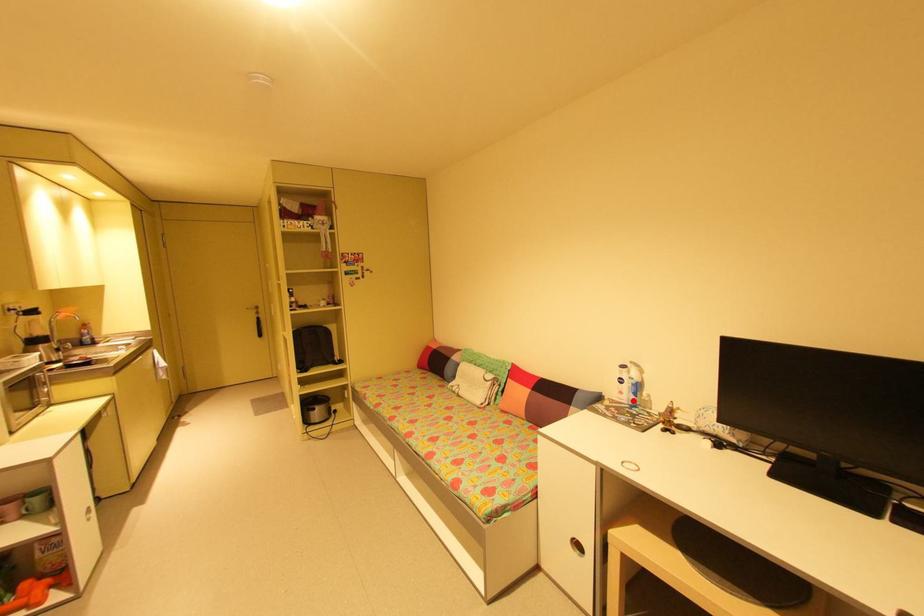
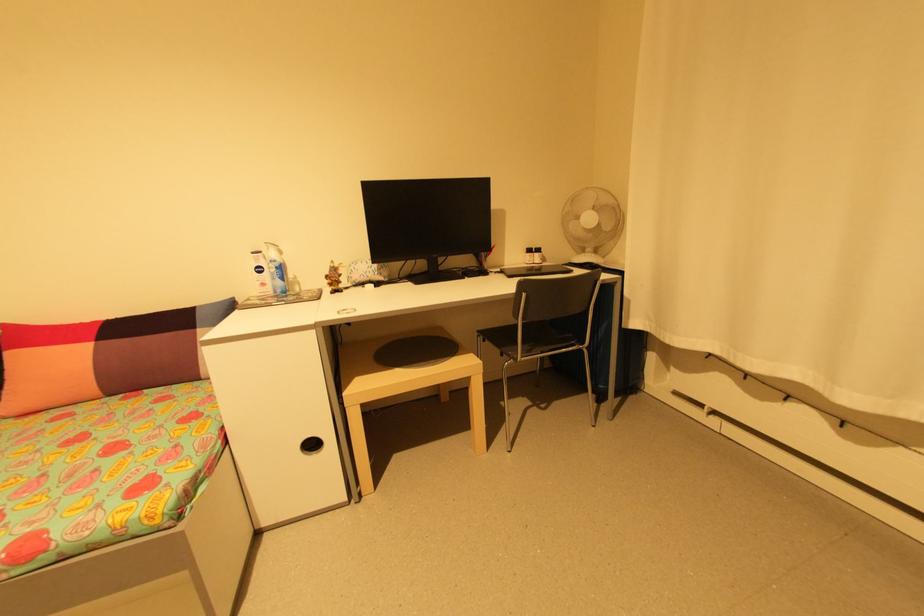
Find the pixel in the second image that matches the highlighted location in the first image.

(280, 291)